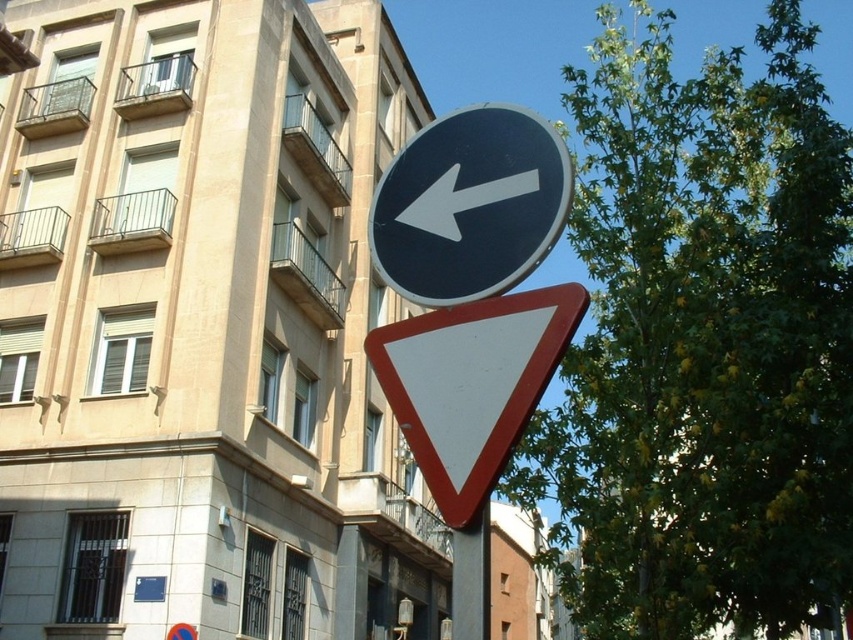
Question: Is green leafy tree at upper right to the left of white glossy arrow at upper center from the viewer's perspective?

Choices:
 (A) yes
 (B) no

Answer: (B)

Question: Can you confirm if black plastic sign at upper center is wider than white plastic triangle at center?

Choices:
 (A) no
 (B) yes

Answer: (B)

Question: Based on their relative distances, which object is farther from the white plastic triangle at center?

Choices:
 (A) white glossy arrow at upper center
 (B) black plastic sign at upper center
 (C) metallic pole at center
 (D) green leafy tree at upper right

Answer: (D)

Question: Which object is closer to the camera taking this photo?

Choices:
 (A) black plastic sign at upper center
 (B) white plastic triangle at center
 (C) green leafy tree at upper right
 (D) metallic pole at center

Answer: (D)

Question: Among these objects, which one is nearest to the camera?

Choices:
 (A) white glossy arrow at upper center
 (B) white plastic triangle at center
 (C) black plastic sign at upper center

Answer: (B)

Question: Is black plastic sign at upper center above white plastic triangle at center?

Choices:
 (A) yes
 (B) no

Answer: (A)